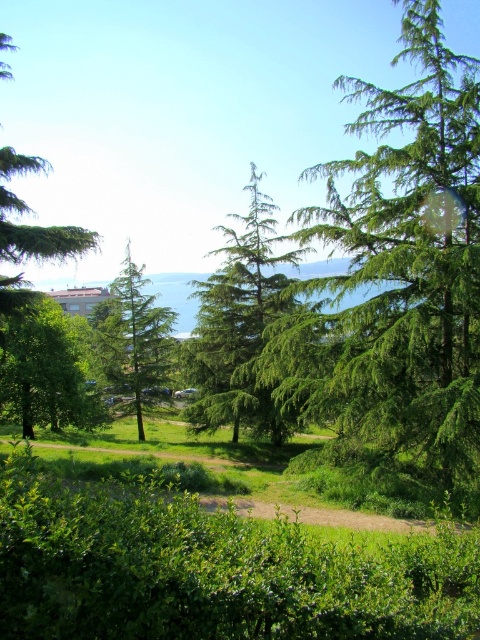
Question: Which point is farther from the camera taking this photo?

Choices:
 (A) pos(16,419)
 (B) pos(127,305)
 (C) pos(73,237)
 (D) pos(339,353)

Answer: (B)

Question: Is green needle-like at center positioned in front of green matte tree at upper left?

Choices:
 (A) no
 (B) yes

Answer: (B)

Question: Which of the following is the closest to the observer?

Choices:
 (A) (109, 378)
 (B) (31, 417)

Answer: (B)

Question: Does green needle-like at center have a greater width compared to green leafy tree at left?

Choices:
 (A) no
 (B) yes

Answer: (A)

Question: Does green needle-like at center have a greater width compared to green matte tree at upper left?

Choices:
 (A) yes
 (B) no

Answer: (B)

Question: Which point appears farthest from the camera in this image?

Choices:
 (A) pos(15,208)
 (B) pos(404,502)
 (C) pos(200,422)

Answer: (C)